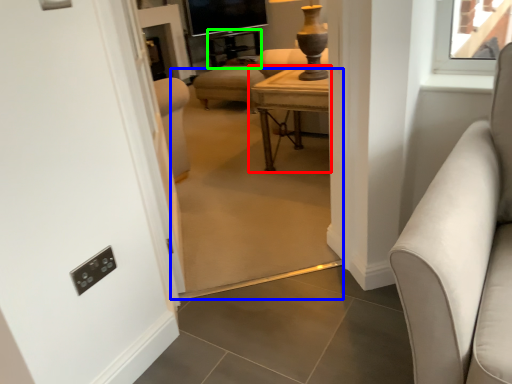
Question: Estimate the real-world distances between objects in this image. Which object is farther from table (highlighted by a red box), plain (highlighted by a blue box) or side table (highlighted by a green box)?

Choices:
 (A) plain
 (B) side table

Answer: (B)